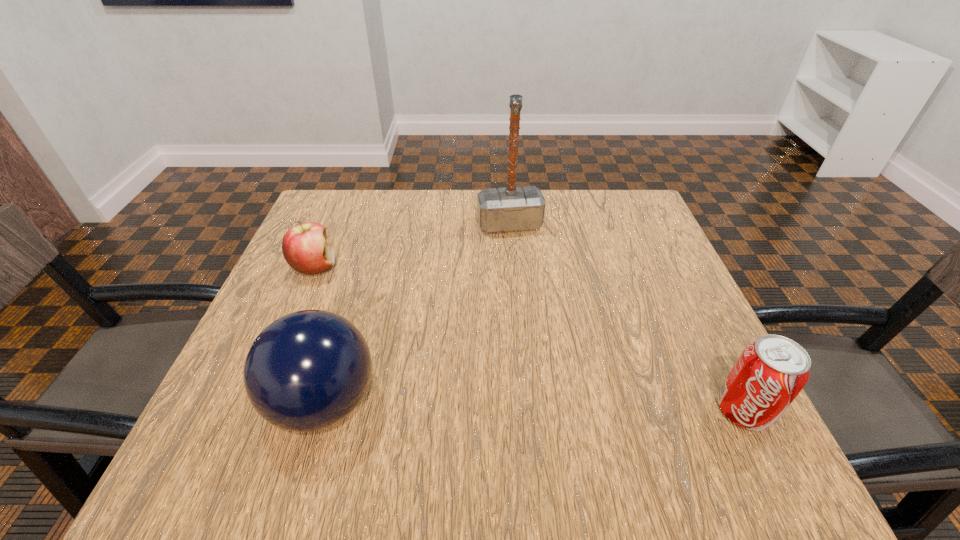
I want to click on empty space that is in between the shortest object and the second object from right to left, so click(412, 246).

Find the location of `vacant area between the apple and the third tallest object`. vacant area between the apple and the third tallest object is located at coordinates (529, 339).

You are a GUI agent. You are given a task and a screenshot of the screen. Output one action in this format:
    pyautogui.click(x=<x>, y=<y>)
    Task: Click on the free space between the second farthest object and the tallest object
    
    Given the screenshot: What is the action you would take?
    pyautogui.click(x=412, y=246)

Identify the location of free space between the third shortest object and the soda. (534, 407).

Where is `free area in between the hammer and the bowling ball`? The width and height of the screenshot is (960, 540). free area in between the hammer and the bowling ball is located at coordinates pos(417,314).

The height and width of the screenshot is (540, 960). Find the location of `vacant point located between the tallest object and the shortest object`. vacant point located between the tallest object and the shortest object is located at coordinates (412, 246).

Locate an element on the screen. The width and height of the screenshot is (960, 540). empty location between the third nearest object and the hammer is located at coordinates (412, 246).

I want to click on free area in between the tallest object and the bowling ball, so click(417, 314).

Where is `vacant area that lies between the soda and the bowling ball`? This screenshot has width=960, height=540. vacant area that lies between the soda and the bowling ball is located at coordinates (534, 407).

Identify the location of the third closest object relative to the second tallest object. The image size is (960, 540). (769, 374).